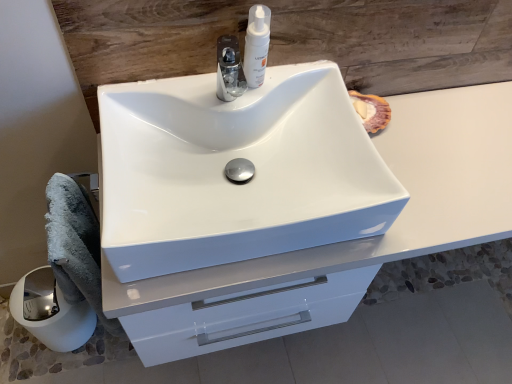
Where is `vacant space positioned to the left of white glossy paper towel at lower left`? This screenshot has width=512, height=384. vacant space positioned to the left of white glossy paper towel at lower left is located at coordinates (16, 346).